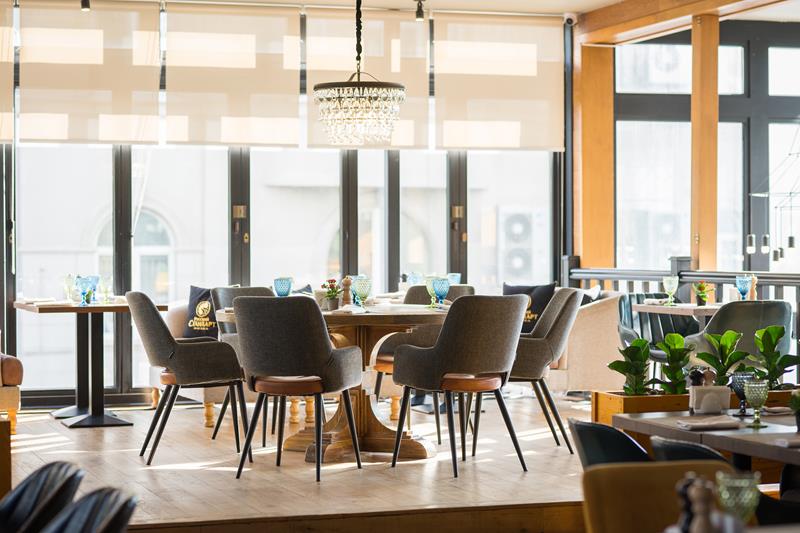
Where is `chair`? The image size is (800, 533). chair is located at coordinates [174, 359], [276, 348], [453, 355], [541, 344], [750, 326], [461, 290], [224, 302], [14, 378], [646, 325].